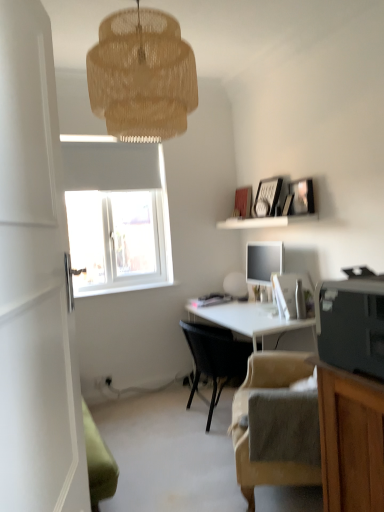
At what (x,y) coordinates should I click in order to perform the action: click on free region on the left part of black woven chair at center, the 1th chair in the back-to-front sequence. Please return your answer as a coordinate pair (x, y). The height and width of the screenshot is (512, 384). Looking at the image, I should click on (151, 418).